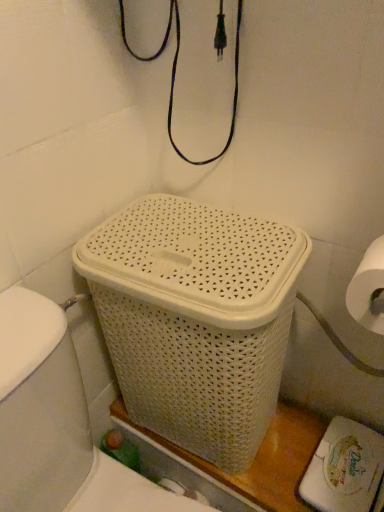
This screenshot has width=384, height=512. What are the coordinates of `free spot above white woven basket at center (from a real-world perspective)` in the screenshot? It's located at (155, 229).